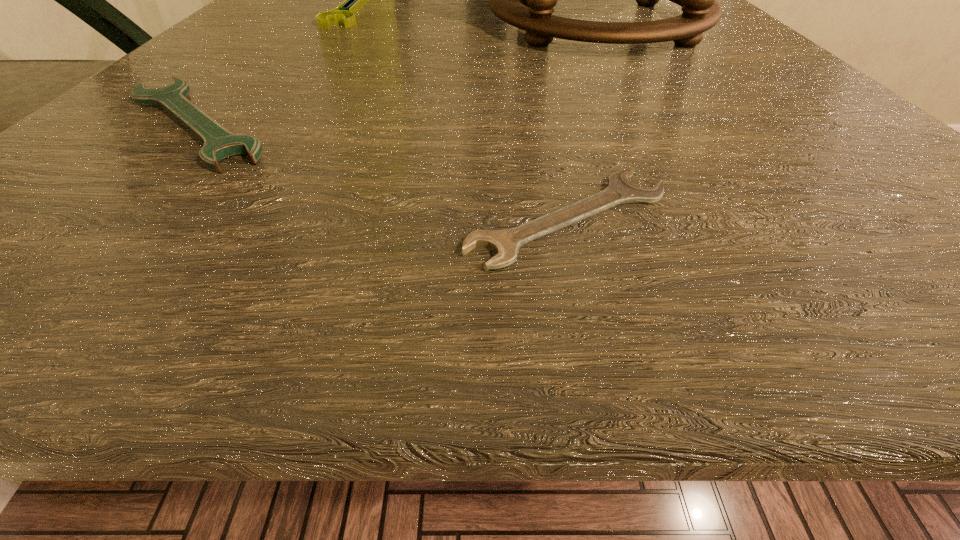
At what (x,y) coordinates should I click in order to perform the action: click on free space at the near left corner of the desktop. Please return your answer as a coordinate pair (x, y). Looking at the image, I should click on 96,285.

This screenshot has height=540, width=960. Find the location of `free space at the near right corner of the desktop`. free space at the near right corner of the desktop is located at coordinates (938, 237).

Locate an element on the screen. empty space between the third farthest object and the nearest object is located at coordinates (382, 171).

I want to click on object that is the closest one to the farthest wrench, so click(x=525, y=0).

Locate an element on the screen. object that is the second closest to the globe is located at coordinates (219, 144).

In order to click on wrench that stands as the second closest to the nearest object in this screenshot , I will do [354, 0].

Find the location of `the second closest wrench to the second nearest wrench`. the second closest wrench to the second nearest wrench is located at coordinates (354, 0).